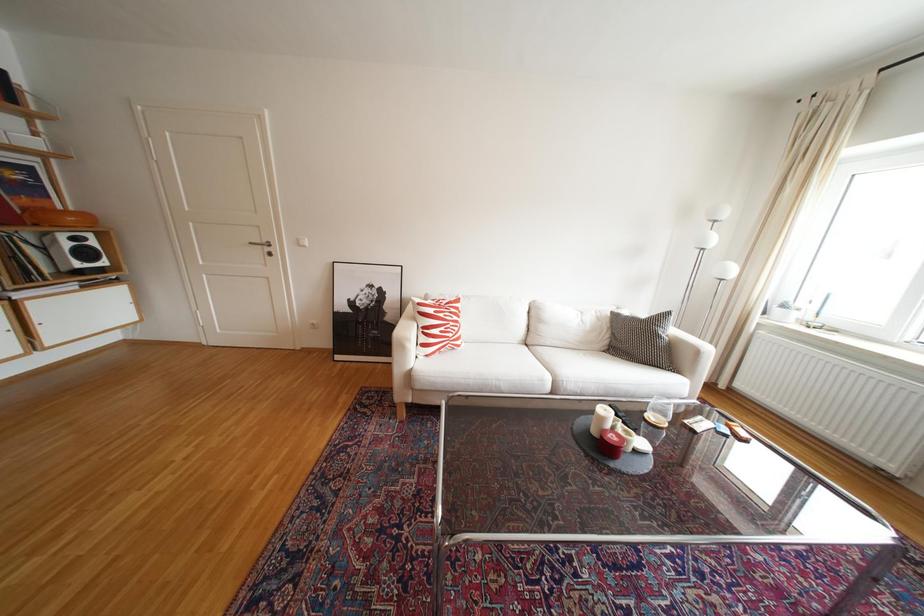
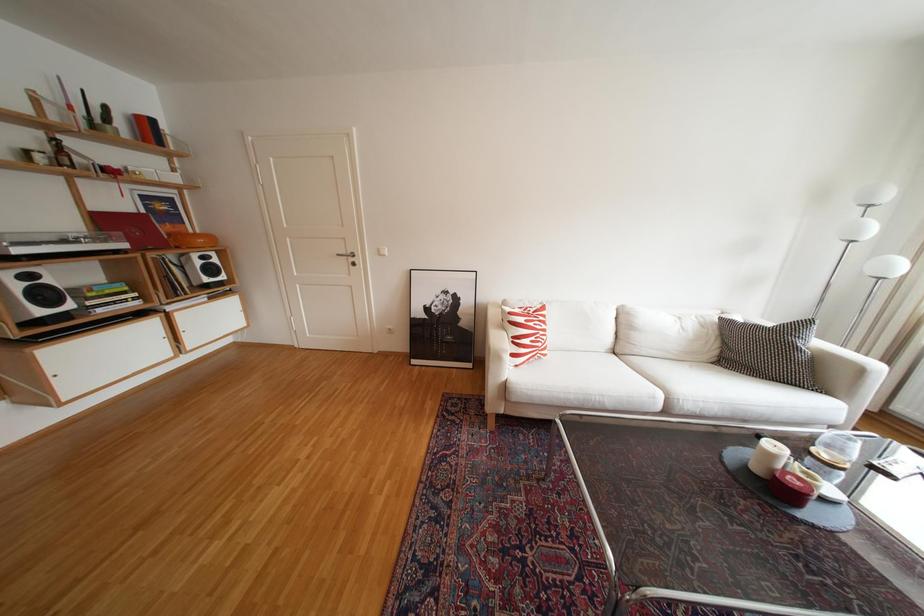
Question: The camera is either moving clockwise (left) or counter-clockwise (right) around the object. The first image is from the beginning of the video and the second image is from the end. Is the camera moving left or right when shooting the video?

Choices:
 (A) Left
 (B) Right

Answer: (B)